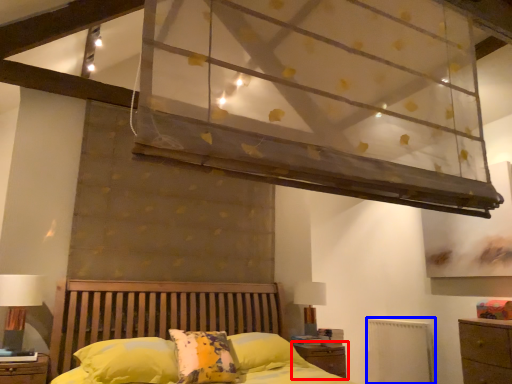
Question: Which point is further to the camera, nightstand (highlighted by a red box) or radiator (highlighted by a blue box)?

Choices:
 (A) nightstand
 (B) radiator

Answer: (B)